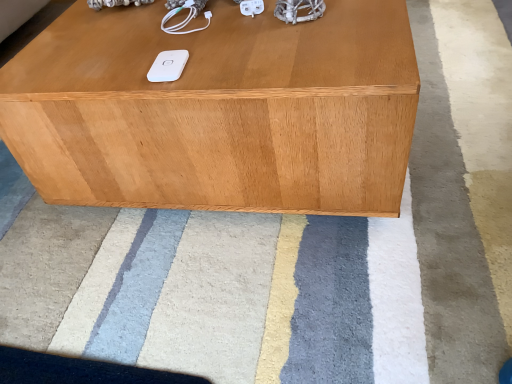
Question: From a real-world perspective, relative to light brown wood table at center, is white soft rug at center vertically above or below?

Choices:
 (A) above
 (B) below

Answer: (B)

Question: From the image's perspective, is white soft rug at center positioned above or below light brown wood table at center?

Choices:
 (A) above
 (B) below

Answer: (B)

Question: Estimate the real-world distances between objects in this image. Which object is closer to the light brown wood table at center?

Choices:
 (A) white matte ipod at center
 (B) white soft rug at center

Answer: (A)

Question: Considering the real-world distances, which object is closest to the white matte ipod at center?

Choices:
 (A) light brown wood table at center
 (B) white soft rug at center

Answer: (A)